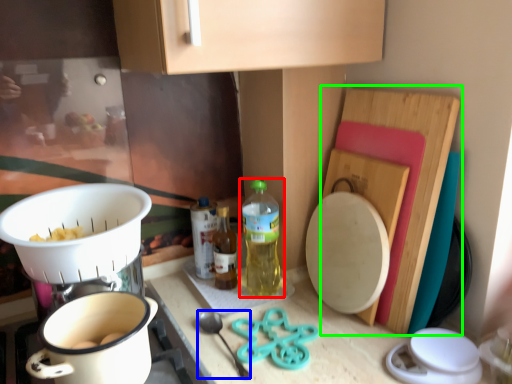
Question: Estimate the real-world distances between objects in this image. Which object is farther from bottle (highlighted by a red box), utensil (highlighted by a blue box) or cutting board (highlighted by a green box)?

Choices:
 (A) utensil
 (B) cutting board

Answer: (B)